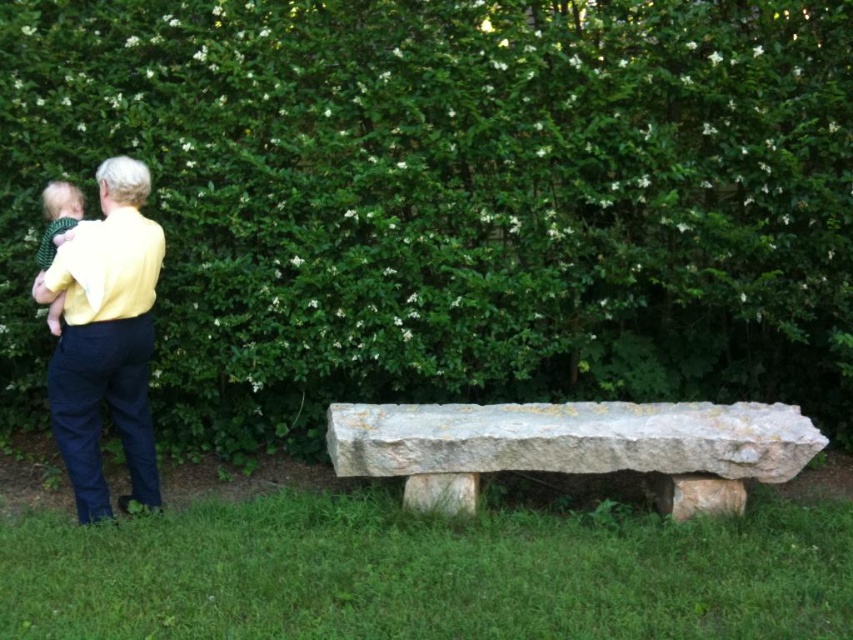
Based on the photo, you are a photographer trying to capture a clear photo of the white stone bench at center without the green leafy hedge at upper center blocking it. Based on their positions, is this possible?

The white stone bench at center is behind the green leafy hedge at upper center, so taking a clear photo without the hedge blocking it would not be possible unless you move your position to find an angle where the bench is visible beyond the hedge.

You are a landscape architect designing a garden path that needs to pass between the green leafy hedge at upper center and the white stone bench at center. Considering their heights, which object might block the view for someone walking along the path?

The green leafy hedge at upper center is taller than the white stone bench at center, so it might block the view for someone walking along the path.